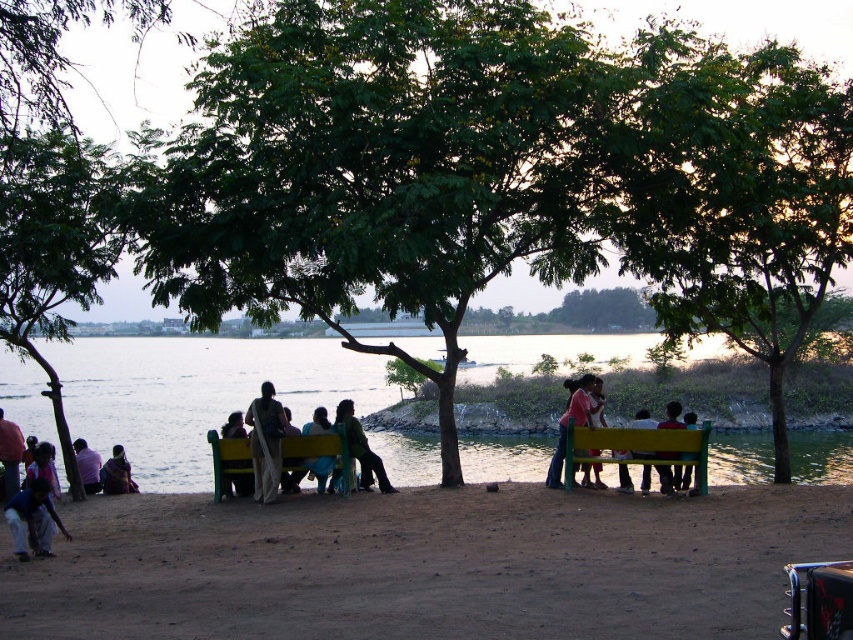
From the picture: You are standing at the point marked by the coordinates point (426, 564) in the image. Looking around, what type of ground surface are you currently standing on?

The point (426, 564) marks brown sandy ground at lower center, so you are standing on brown sandy ground.

You are standing at the point marked by the coordinates point (32, 518) in the image. Looking around, what object is located at those coordinates?

The coordinates point (32, 518) correspond to dark blue jeans at lower left.

You are a photographer wanting to capture the matte pink shirt at center without the green fabric bench at center blocking it. Can you move to a position where the bench is out of the shot?

The matte pink shirt at center is behind the green fabric bench at center, so if you move to a position where you can see behind the bench, the shirt will be visible without obstruction.